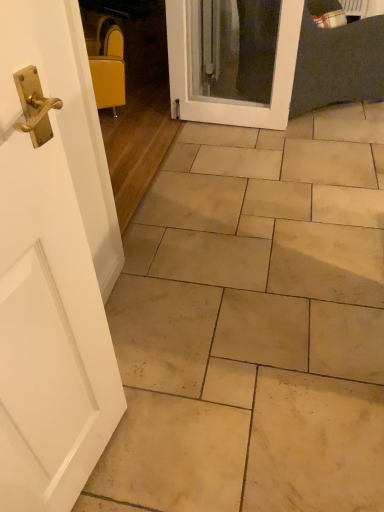
Where is `free space above beige stone tile at center (from a real-world perspective)`? Image resolution: width=384 pixels, height=512 pixels. free space above beige stone tile at center (from a real-world perspective) is located at coordinates (276, 201).